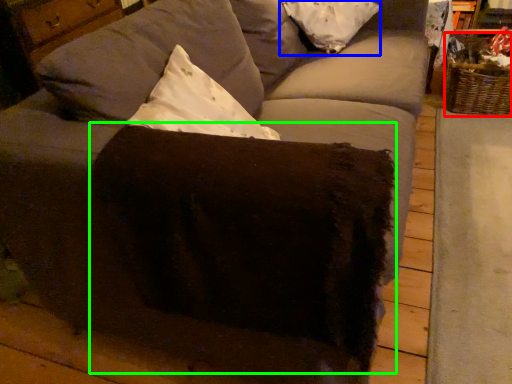
Question: Which is nearer to the basket (highlighted by a red box)? pillow (highlighted by a blue box) or swivel chair (highlighted by a green box).

Choices:
 (A) pillow
 (B) swivel chair

Answer: (A)